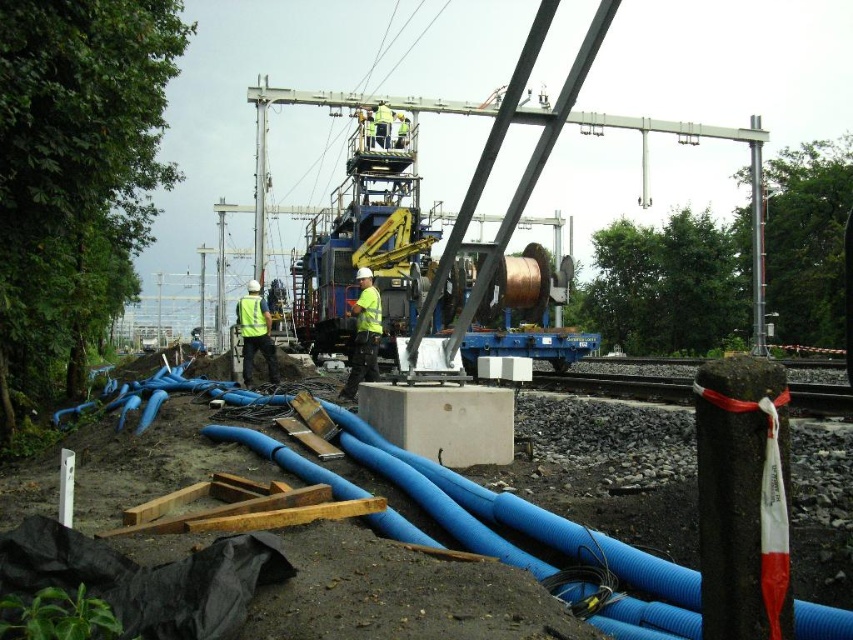
Describe the element at coordinates (364, 333) in the screenshot. I see `yellow reflective vest at center` at that location.

Is yellow reflective vest at center above reflective yellow vest at center?

Actually, yellow reflective vest at center is below reflective yellow vest at center.

Identify the location of yellow reflective vest at center. (364, 333).

I want to click on yellow reflective vest at center, so click(x=364, y=333).

Consider the image. Which of these two, blue rubber pipes at lower left or yellow reflective safety vest at center, stands shorter?

blue rubber pipes at lower left is shorter.

Can you confirm if blue rubber pipes at lower left is shorter than yellow reflective safety vest at center?

Yes.

You are a GUI agent. You are given a task and a screenshot of the screen. Output one action in this format:
    pyautogui.click(x=<x>, y=<y>)
    Task: Click on the blue rubber pipes at lower left
    The width and height of the screenshot is (853, 640).
    Given the screenshot: What is the action you would take?
    pyautogui.click(x=210, y=470)

The width and height of the screenshot is (853, 640). Find the location of `blue rubber pipes at lower left`. blue rubber pipes at lower left is located at coordinates (210, 470).

Is yellow reflective vest at center closer to the viewer compared to brushed metal pole at center?

That is True.

Is yellow reflective vest at center wider than brushed metal pole at center?

No, yellow reflective vest at center is not wider than brushed metal pole at center.

Locate an element on the screen. yellow reflective vest at center is located at coordinates [364, 333].